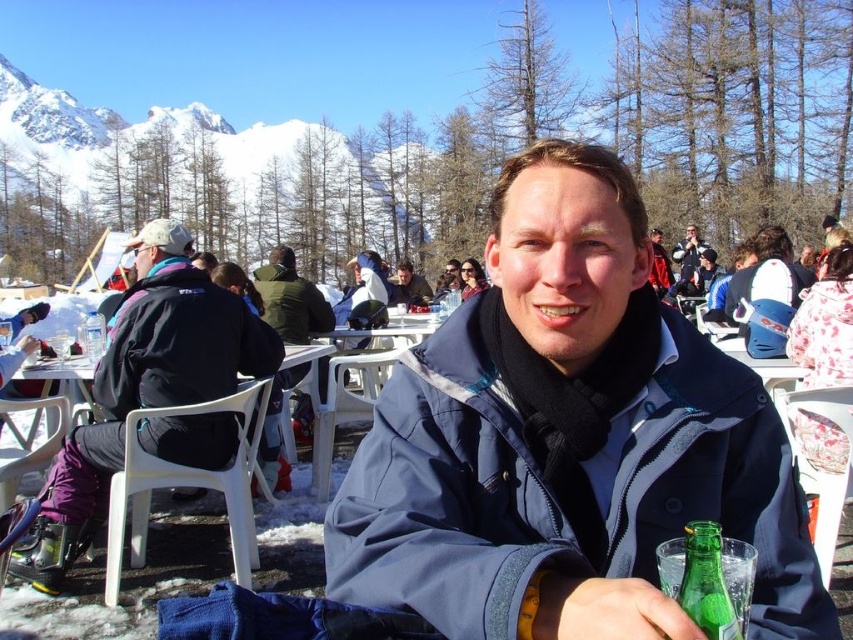
You are a photographer standing at the edge of the scene. You want to take a photo of the blue matte jacket at center and the white plastic table at lower left. Can you position yourself so that both are visible in the frame without any obstruction?

The blue matte jacket at center is in front of the white plastic table at lower left, so positioning yourself to capture both without obstruction may be challenging. Adjust your angle slightly to ensure both are visible.

You are a photographer trying to capture the man in his blue matte jacket at center without including the white plastic table at lower left in the frame. Is this possible given their positions?

The blue matte jacket at center is positioned over the white plastic table at lower left, so it would be challenging to capture the jacket without including the table in the frame.